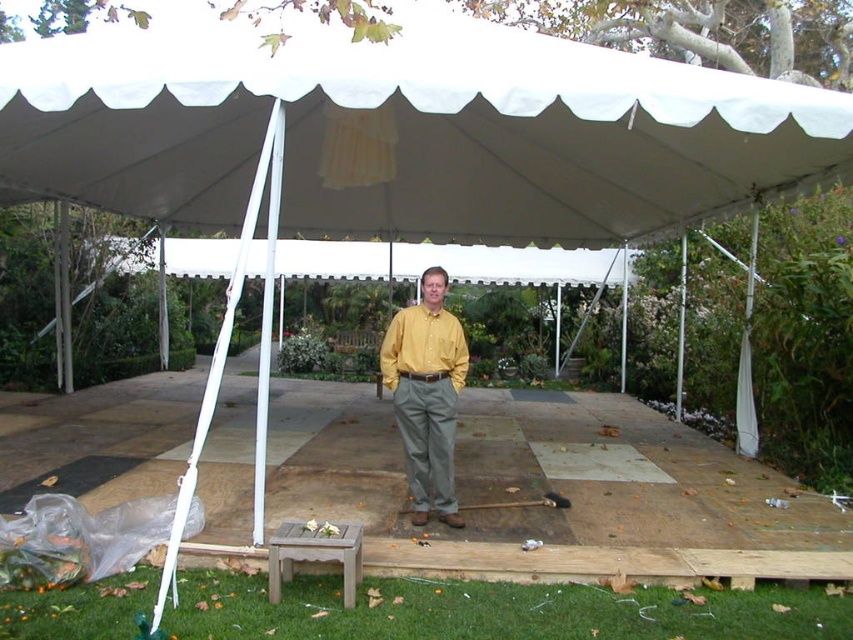
You are a photographer setting up for an event under the tent. You need to position a camera tripod so that it doesn not block the view of the yellow matte shirt at center from the teak wood stool at lower center. Based on their heights, can the tripod be placed between them without being seen?

The yellow matte shirt at center has a greater height than the teak wood stool at lower center. Since the shirt is taller, placing the tripod between them might still allow the stool to see the shirt over the tripod, but the exact visibility depends on the tripod height. However, based on the height difference provided, the tripod could potentially be placed lower or at the same height as the stool to ensure the shirt remains visible.